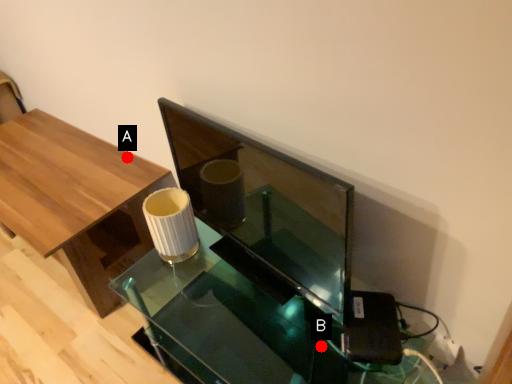
Question: Two points are circled on the image, labeled by A and B beside each circle. Which point is farther to the camera?

Choices:
 (A) A is further
 (B) B is further

Answer: (A)